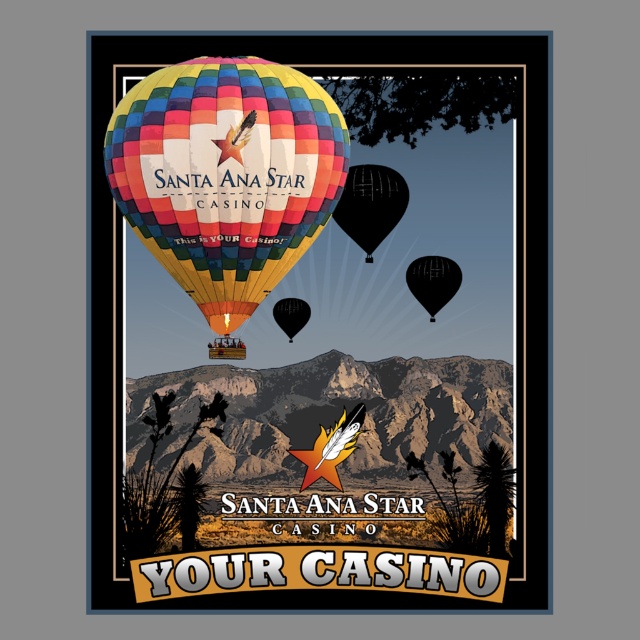
You are standing in front of the Santa Ana Star Casino poster and see two points marked on it. The first point is at coordinate point (451, 262) and the second is at point (300, 320). Which point is closer to you?

Point (451, 262) is closer to the viewer than point (300, 320).